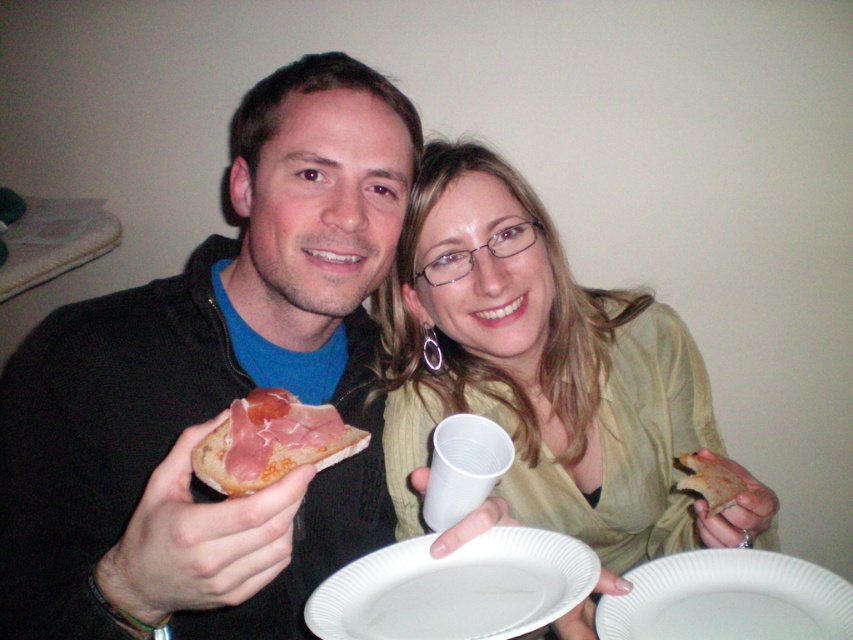
Can you confirm if matte black jacket at center is bigger than white paper plate at lower center?

Yes.

Consider the image. Who is higher up, matte black jacket at center or white paper plate at lower center?

matte black jacket at center is higher up.

Between point (363, 252) and point (660, 561), which one is positioned in front?

Point (660, 561)

Find the location of a particular element. matte black jacket at center is located at coordinates (213, 388).

Between matte black jacket at center and golden crispy pizza slice at right, which one is positioned higher?

matte black jacket at center

Is point (148, 412) farther from viewer compared to point (704, 477)?

That is True.

The height and width of the screenshot is (640, 853). What do you see at coordinates (213, 388) in the screenshot? I see `matte black jacket at center` at bounding box center [213, 388].

You are a GUI agent. You are given a task and a screenshot of the screen. Output one action in this format:
    pyautogui.click(x=<x>, y=<y>)
    Task: Click on the matte black jacket at center
    
    Given the screenshot: What is the action you would take?
    pyautogui.click(x=213, y=388)

What do you see at coordinates (456, 588) in the screenshot? Image resolution: width=853 pixels, height=640 pixels. I see `white paper plate at center` at bounding box center [456, 588].

Who is more forward, (492,576) or (643,564)?

Positioned in front is point (492,576).

Between point (397, 625) and point (677, 600), which one is positioned behind?

Positioned behind is point (677, 600).

You are a GUI agent. You are given a task and a screenshot of the screen. Output one action in this format:
    pyautogui.click(x=<x>, y=<y>)
    Task: Click on the white paper plate at center
    
    Given the screenshot: What is the action you would take?
    pyautogui.click(x=456, y=588)